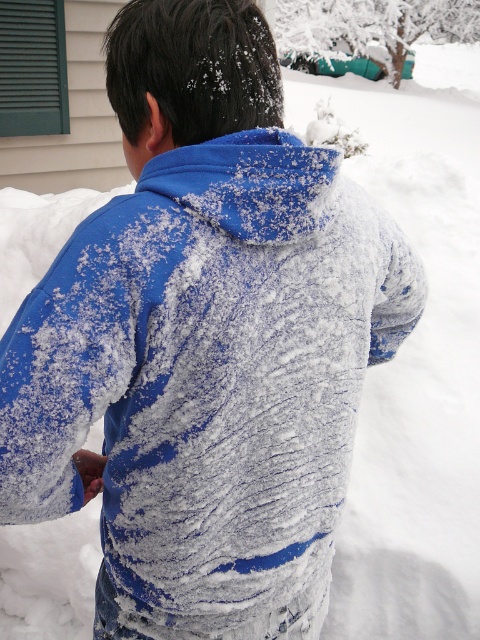
You are a photographer trying to capture the blue fleece jacket at center and the white fluffy snowman at upper center in the same frame. Based on their positions, which object should be closer to the bottom of the photo?

The blue fleece jacket at center is positioned under the white fluffy snowman at upper center, so the blue fleece jacket at center should be closer to the bottom of the photo.

You are a photographer trying to capture a photo of the blue fleece jacket at center and the white fluffy snowman at upper center. If you want to make sure both subjects are in focus, which one should you focus on first considering their sizes?

The blue fleece jacket at center has a smaller size compared to the white fluffy snowman at upper center. To ensure both are in focus, you should focus on the smaller subject first, which is the blue fleece jacket at center.

You are a drone operator trying to capture a photo of the snowy scene. You need to focus on two specific points marked as point 1 at coordinates point (181, 205) and point 2 at coordinates point (344, 152). Which point should you focus on first to ensure the closest object is in sharp focus?

Point 1 at coordinates point (181, 205) is closer to the viewer than point 2 at coordinates point (344, 152), so focusing on point 1 first will ensure the closest object is in sharp focus.